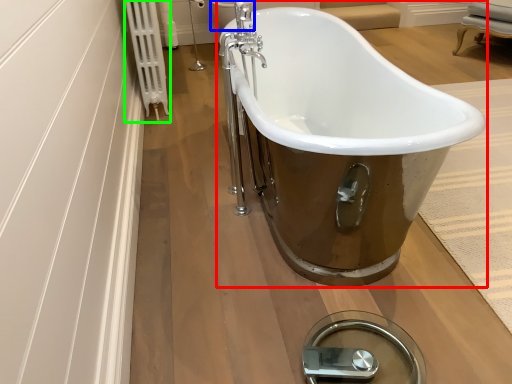
Question: Considering the real-world distances, which object is closest to bathtub (highlighted by a red box)? toilet bowl (highlighted by a blue box) or radiator (highlighted by a green box).

Choices:
 (A) toilet bowl
 (B) radiator

Answer: (B)